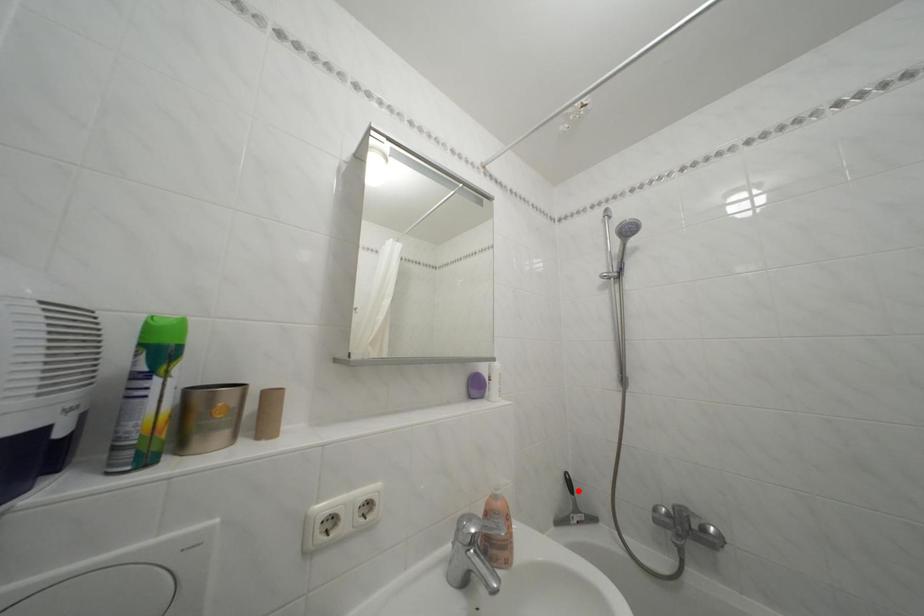
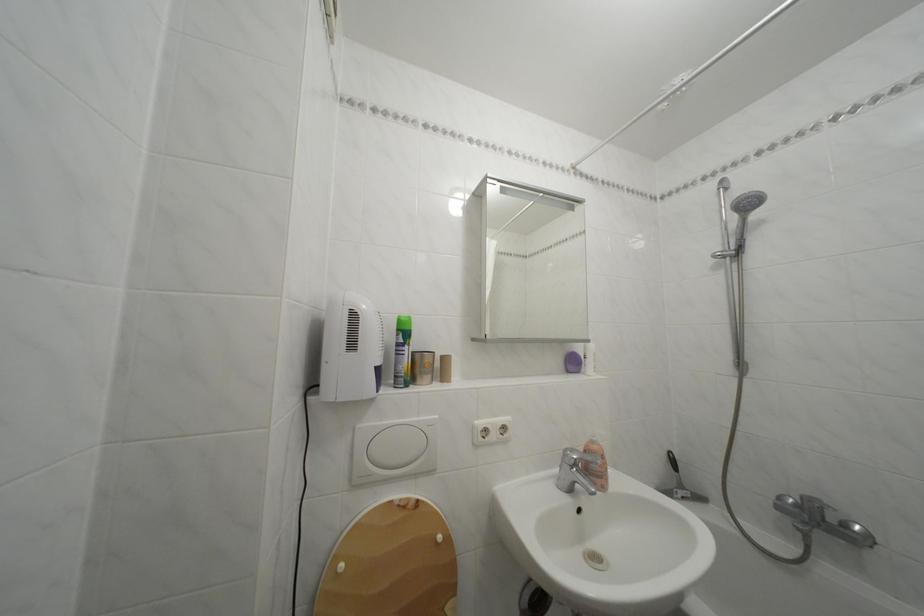
Where in the second image is the point corresponding to the highlighted location from the first image?

(682, 468)